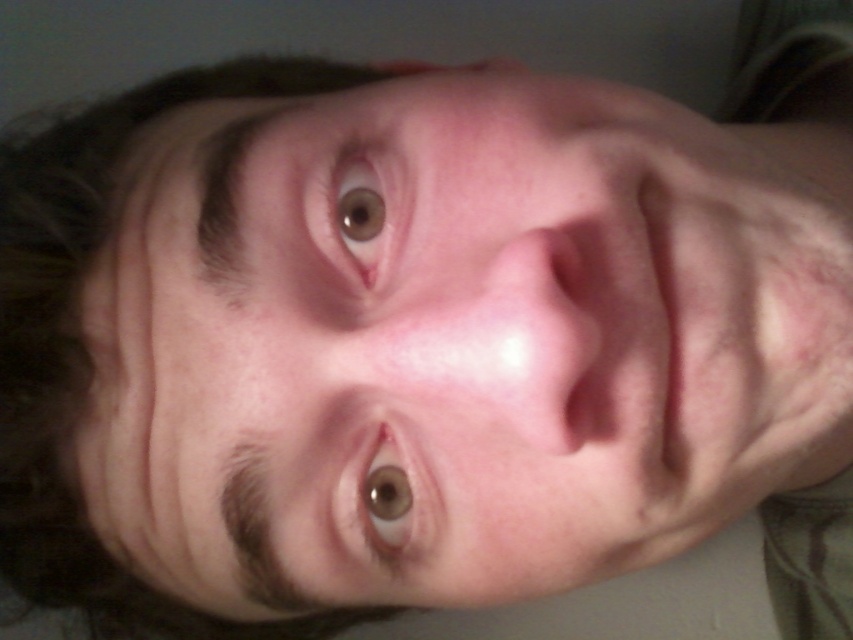
Is point (22, 520) positioned after point (425, 504)?

That is True.

Identify the location of dark brown hair at upper left. The image size is (853, 640). (84, 346).

Between brown matte eye at center and brown matte eye at upper center, which one is positioned lower?

brown matte eye at center is below.

Can you confirm if brown matte eye at center is positioned above brown matte eye at upper center?

No.

At what (x,y) coordinates should I click in order to perform the action: click on brown matte eye at center. Please return your answer as a coordinate pair (x, y). The width and height of the screenshot is (853, 640). Looking at the image, I should click on (387, 499).

This screenshot has width=853, height=640. What do you see at coordinates (84, 346) in the screenshot?
I see `dark brown hair at upper left` at bounding box center [84, 346].

Who is lower down, dark brown hair at upper left or brown matte eye at upper center?

brown matte eye at upper center is lower down.

Find the location of a particular element. This screenshot has height=640, width=853. dark brown hair at upper left is located at coordinates (84, 346).